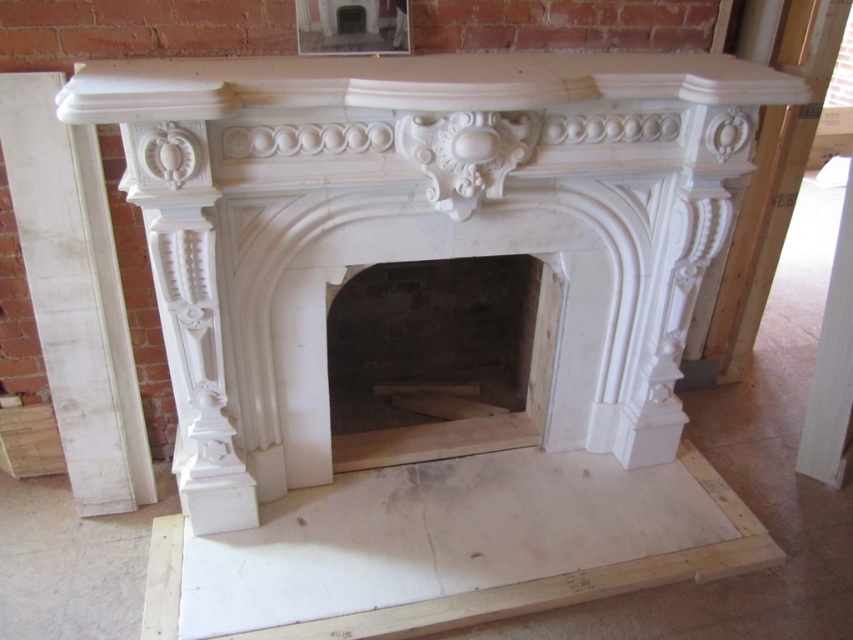
Can you confirm if white marble fireplace at center is bigger than white marble fireplace at left?

Indeed, white marble fireplace at center has a larger size compared to white marble fireplace at left.

This screenshot has height=640, width=853. I want to click on white marble fireplace at center, so click(x=419, y=227).

Can you confirm if white marble fireplace at center is taller than white marble fireplace at right?

Correct, white marble fireplace at center is much taller as white marble fireplace at right.

Who is more distant from viewer, [146,108] or [732,294]?

Point [732,294]

The height and width of the screenshot is (640, 853). In order to click on white marble fireplace at center in this screenshot , I will do `click(419, 227)`.

Who is more distant from viewer, (131,452) or (733,230)?

Point (733,230)

Which is above, white marble fireplace at left or white marble fireplace at right?

white marble fireplace at right

This screenshot has height=640, width=853. What are the coordinates of `white marble fireplace at left` in the screenshot? It's located at (74, 296).